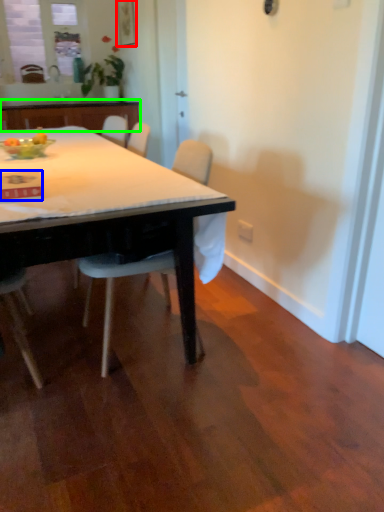
Question: Which is farther away from picture frame (highlighted by a red box)? kitchen & dining room table (highlighted by a blue box) or cabinetry (highlighted by a green box)?

Choices:
 (A) kitchen & dining room table
 (B) cabinetry

Answer: (A)